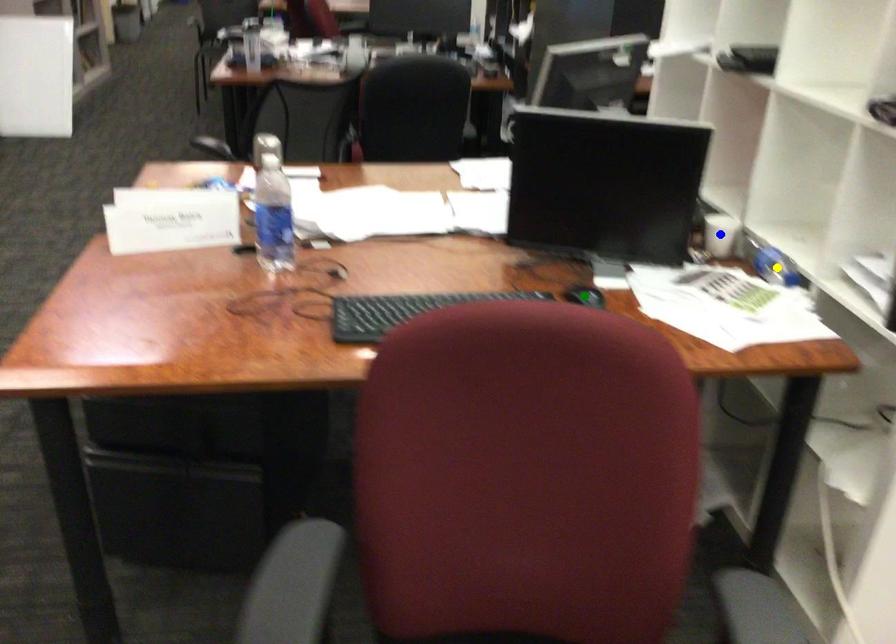
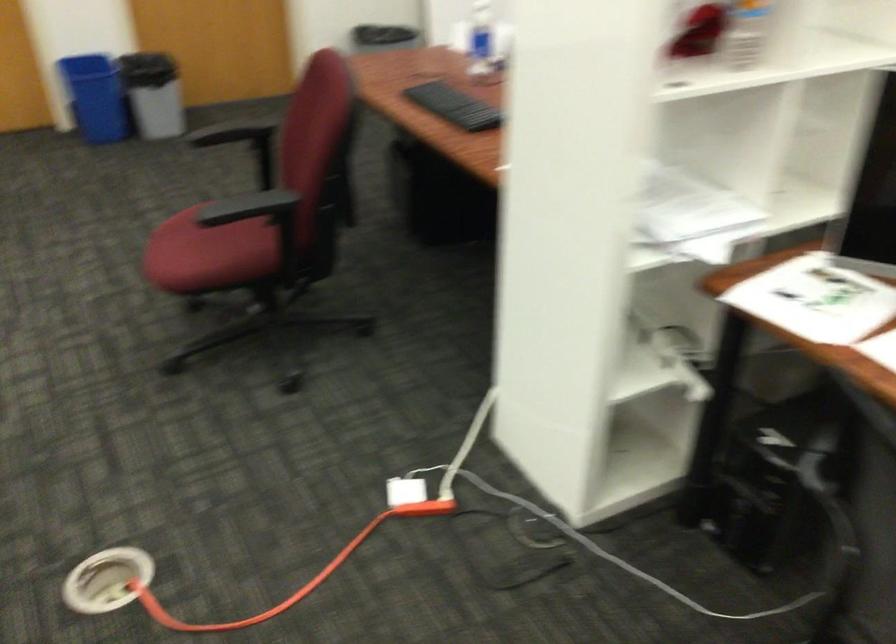
I am providing you with two images of the same scene from different viewpoints. Three points are marked in image1. Which point corresponds to a part or object that is occluded in image2?In image1, three points are marked. Which of them correspond to a part or object that is occluded in image2?Among the three points shown in image1, which one corresponds to a part or object that is no longer visible due to occlusion in image2?

Invisible in image2: green point, yellow point, blue point.